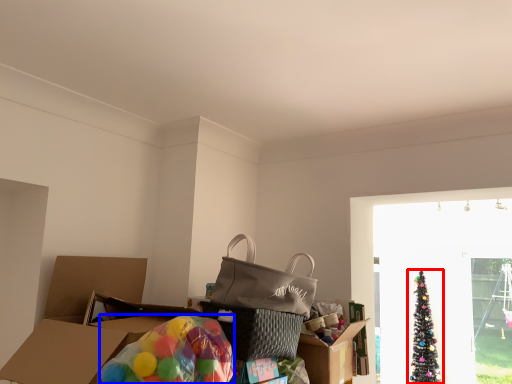
Question: Among these objects, which one is farthest to the camera, christmas tree (highlighted by a red box) or balloon (highlighted by a blue box)?

Choices:
 (A) christmas tree
 (B) balloon

Answer: (A)